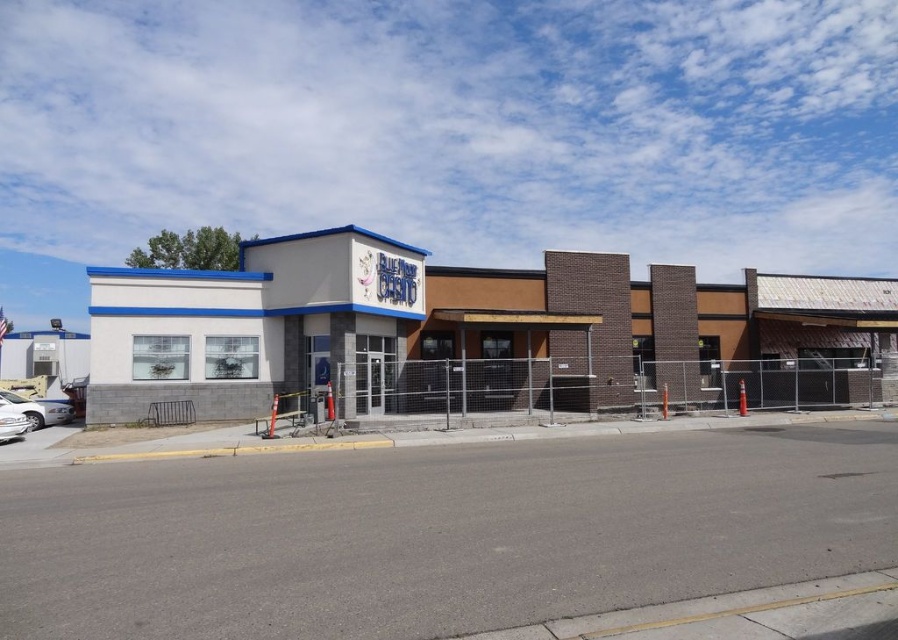
You are a delivery driver approaching the Blue Rose Casino. You see the white brick building at left and the white glossy car at lower left. Which object is positioned higher in the image?

The white brick building at left is located above the white glossy car at lower left, so it is positioned higher in the image.

You are standing at the entrance of the Blue Rose Casino and want to park your car. The parking spot you want is at point (36, 410). Is the white glossy car at lower left blocking your path to that parking spot?

The white glossy car at lower left is located at point (36, 410), so yes, the white glossy car at lower left is blocking your path to that parking spot.